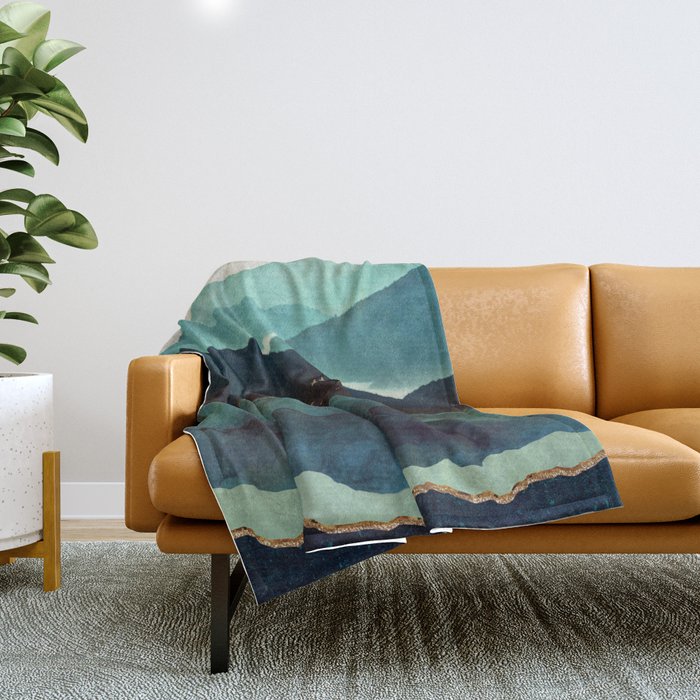
Where is `pleather couch`? pleather couch is located at coordinates (535, 335).